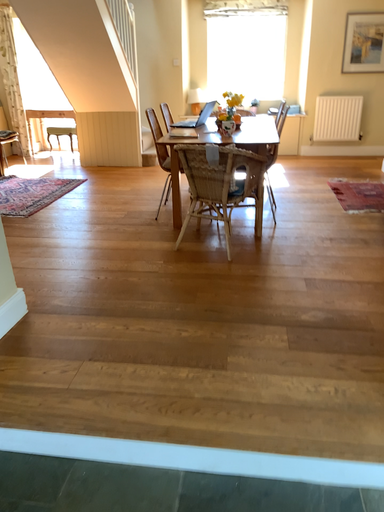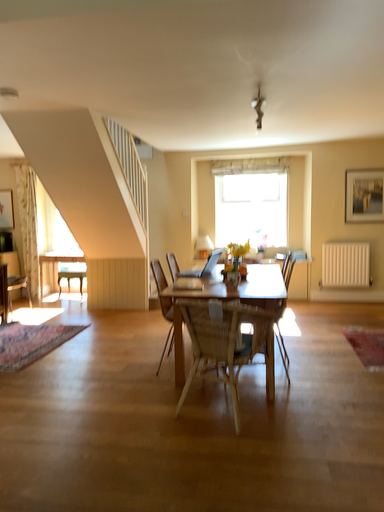
Question: Which way did the camera rotate in the video?

Choices:
 (A) rotated downward
 (B) rotated upward

Answer: (B)